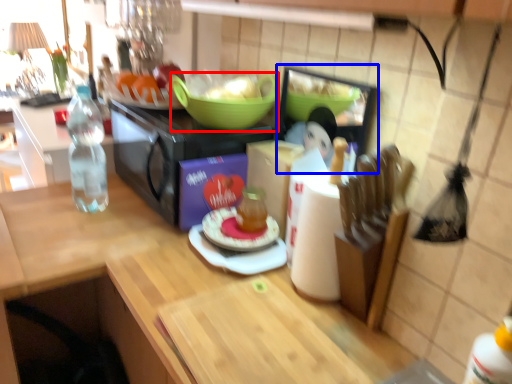
Question: Which object is further to the camera taking this photo, bowl (highlighted by a red box) or appliance (highlighted by a blue box)?

Choices:
 (A) bowl
 (B) appliance

Answer: (A)